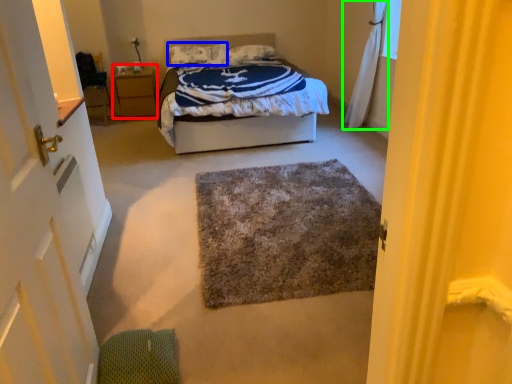
Question: Which object is positioned closest to nightstand (highlighted by a red box)? Select from pillow (highlighted by a blue box) and curtain (highlighted by a green box).

Choices:
 (A) pillow
 (B) curtain

Answer: (A)